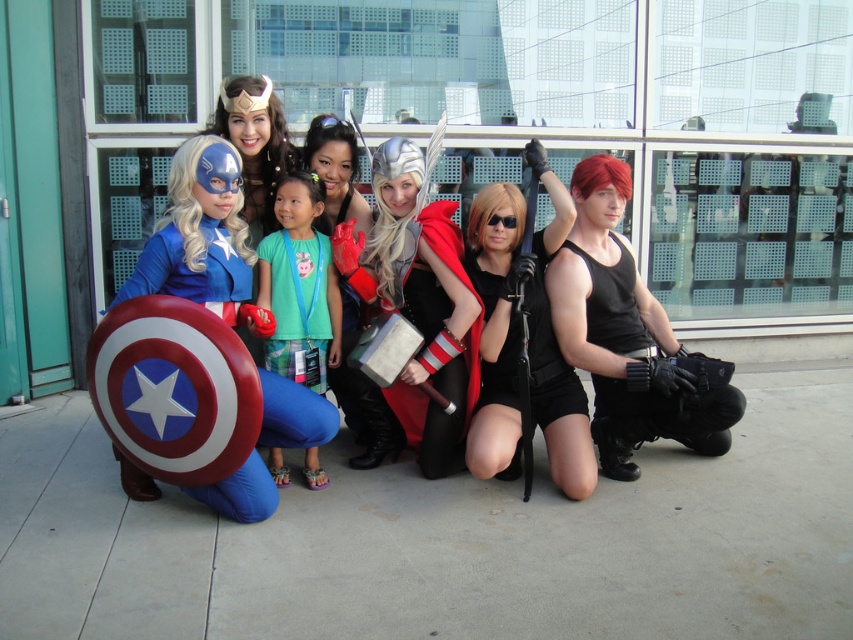
Question: Is matte blue costume at lower left positioned in front of silver metallic hammer at center?

Choices:
 (A) yes
 (B) no

Answer: (A)

Question: Does silver metallic hammer at center have a smaller size compared to green fabric shirt at center?

Choices:
 (A) yes
 (B) no

Answer: (B)

Question: Among these objects, which one is nearest to the camera?

Choices:
 (A) matte blue costume at lower left
 (B) green fabric shirt at center

Answer: (A)

Question: Among these points, which one is nearest to the camera?

Choices:
 (A) (554, 236)
 (B) (280, 260)
 (C) (154, 252)

Answer: (C)

Question: Which point appears farthest from the camera in this image?

Choices:
 (A) (343, 406)
 (B) (225, 209)
 (C) (270, 269)

Answer: (A)

Question: Considering the relative positions of black matte/leather jacket at center and matte blue costume at lower left in the image provided, where is black matte/leather jacket at center located with respect to matte blue costume at lower left?

Choices:
 (A) left
 (B) right

Answer: (B)